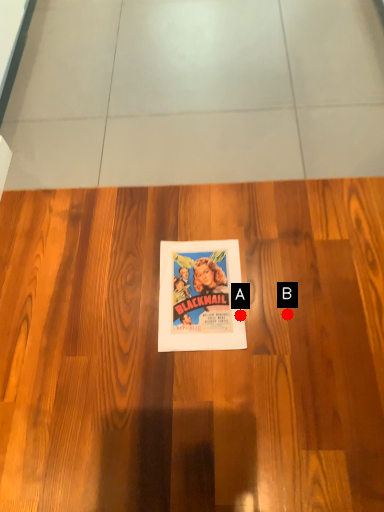
Question: Two points are circled on the image, labeled by A and B beside each circle. Which point is closer to the camera?

Choices:
 (A) A is closer
 (B) B is closer

Answer: (B)